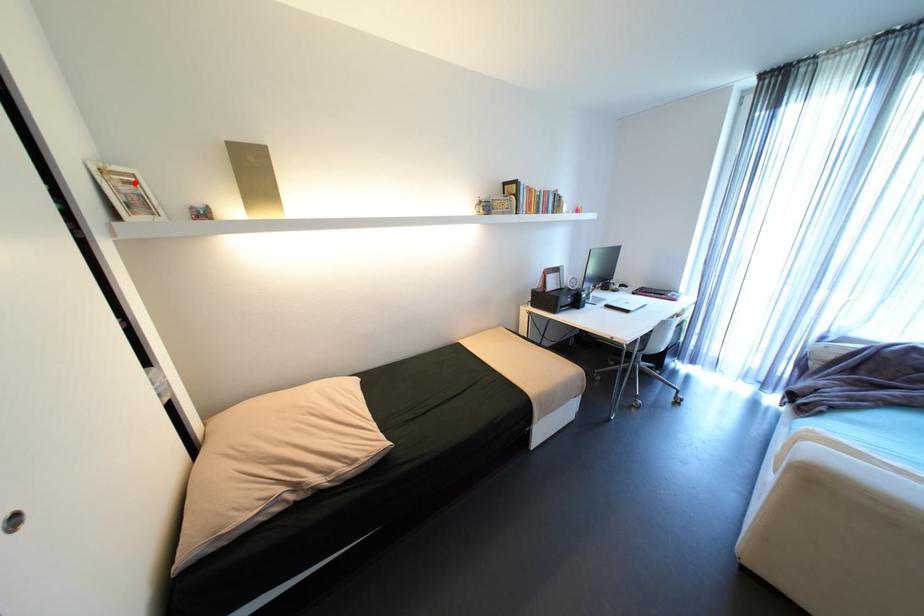
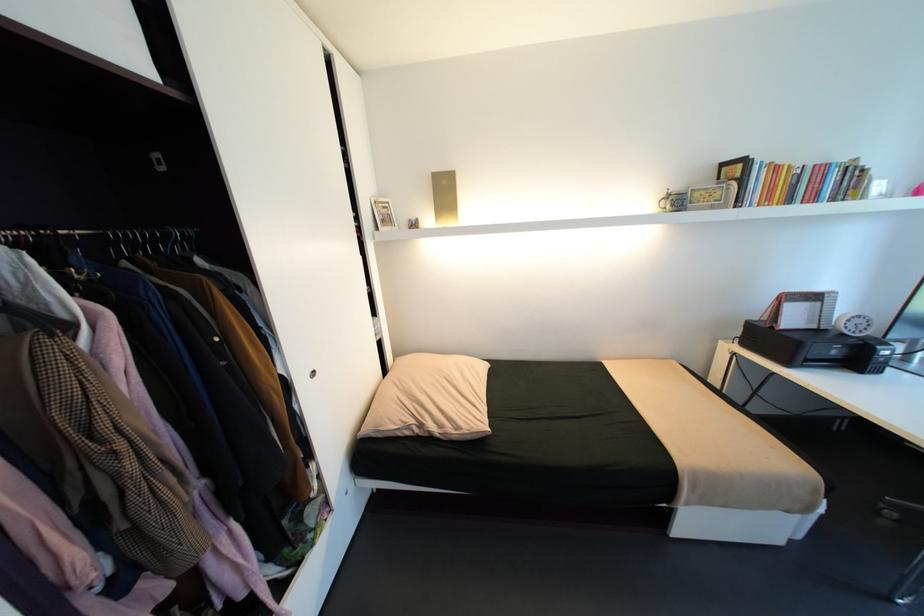
Question: A red point is marked in image1. In image2, is the corresponding 3D point closer to the camera or farther? Reply with the corresponding letter.

Choices:
 (A) The corresponding 3D point is closer.
 (B) The corresponding 3D point is farther.

Answer: (A)